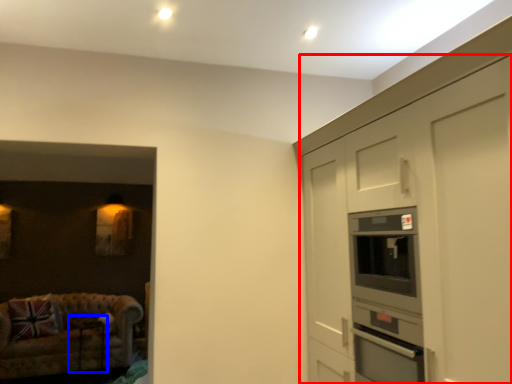
Question: Among these objects, which one is nearest to the camera, cabinetry (highlighted by a red box) or table (highlighted by a blue box)?

Choices:
 (A) cabinetry
 (B) table

Answer: (A)